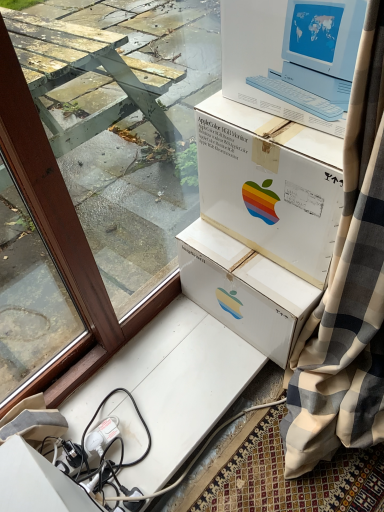
This screenshot has height=512, width=384. Find the location of `brown wood window frame at upper left`. brown wood window frame at upper left is located at coordinates (x=67, y=189).

Identify the location of white cardboard box at upper center. (270, 185).

From a real-world perspective, between white cardboard box at upper center and brown wood window frame at upper left, who is vertically higher?

In real-world perspective, brown wood window frame at upper left is above.

From the image's perspective, relative to brown wood window frame at upper left, is white cardboard box at upper center above or below?

white cardboard box at upper center is situated higher than brown wood window frame at upper left in the image.

Could you tell me if white cardboard box at upper center is facing brown wood window frame at upper left?

Yes, white cardboard box at upper center is oriented towards brown wood window frame at upper left.

Does brown wood window frame at upper left lie behind white plastic apple monitor at upper center?

No, brown wood window frame at upper left is closer to the camera.

In terms of width, does brown wood window frame at upper left look wider or thinner when compared to white plastic apple monitor at upper center?

In the image, brown wood window frame at upper left appears to be more narrow than white plastic apple monitor at upper center.

Between point (153, 100) and point (297, 16), which one is positioned in front?

The point (297, 16) is closer.

Is brown wood window frame at upper left surrounding white plastic apple monitor at upper center?

No.

Is white plastic apple monitor at upper center shorter than white cardboard box at upper center?

Yes, white plastic apple monitor at upper center is shorter than white cardboard box at upper center.

Locate an element on the screen. Image resolution: width=384 pixels, height=512 pixels. laptop in front of the white cardboard box at upper center is located at coordinates (317, 56).

From the image's perspective, is white plastic apple monitor at upper center below white cardboard box at upper center?

No, from the image's perspective, white plastic apple monitor at upper center is not beneath white cardboard box at upper center.

Who is smaller, white plastic apple monitor at upper center or white cardboard box at upper center?

With smaller size is white plastic apple monitor at upper center.

Considering the relative positions of white cardboard box at upper center and white plastic apple monitor at upper center in the image provided, is white cardboard box at upper center in front of white plastic apple monitor at upper center?

No, it is not.

Is white cardboard box at upper center beside white plastic apple monitor at upper center?

white cardboard box at upper center and white plastic apple monitor at upper center are not in contact.

Which is closer, (320,255) or (304,16)?

Clearly, point (320,255) is more distant from the camera than point (304,16).

Could you tell me if white cardboard box at upper center is turned towards white plastic apple monitor at upper center?

No, white cardboard box at upper center does not turn towards white plastic apple monitor at upper center.

How distant is brown wood window frame at upper left from white cardboard box at upper center?

19.64 inches.

Is brown wood window frame at upper left turned away from white cardboard box at upper center?

No, brown wood window frame at upper left is not facing away from white cardboard box at upper center.

Where is `window frame below the white cardboard box at upper center (from the image's perspective)`? The width and height of the screenshot is (384, 512). window frame below the white cardboard box at upper center (from the image's perspective) is located at coordinates (67, 189).

Looking at the image, does brown wood window frame at upper left seem bigger or smaller compared to white cardboard box at upper center?

In the image, brown wood window frame at upper left appears to be larger than white cardboard box at upper center.

Based on the photo, does white plastic apple monitor at upper center have a lesser height compared to brown wood window frame at upper left?

Yes, white plastic apple monitor at upper center is shorter than brown wood window frame at upper left.

Choose the correct answer: Is white plastic apple monitor at upper center inside brown wood window frame at upper left or outside it?

white plastic apple monitor at upper center lies outside brown wood window frame at upper left.

Is white plastic apple monitor at upper center next to brown wood window frame at upper left?

white plastic apple monitor at upper center and brown wood window frame at upper left are clearly separated.

Identify the location of window frame on the left of white cardboard box at upper center. (67, 189).

Image resolution: width=384 pixels, height=512 pixels. I want to click on laptop above the brown wood window frame at upper left (from a real-world perspective), so click(x=317, y=56).

Considering their positions, is white cardboard box at upper center positioned closer to brown wood window frame at upper left than white plastic apple monitor at upper center?

The object closer to brown wood window frame at upper left is white cardboard box at upper center.

Considering their positions, is brown wood window frame at upper left positioned closer to white cardboard box at upper center than white plastic apple monitor at upper center?

white plastic apple monitor at upper center.

Consider the image. Looking at the image, which one is located closer to brown wood window frame at upper left, white plastic apple monitor at upper center or white cardboard box at upper center?

white cardboard box at upper center.

When comparing their distances from white plastic apple monitor at upper center, does white cardboard box at upper center or brown wood window frame at upper left seem closer?

Based on the image, white cardboard box at upper center appears to be nearer to white plastic apple monitor at upper center.

Which object lies further to the anchor point white cardboard box at upper center, white plastic apple monitor at upper center or brown wood window frame at upper left?

brown wood window frame at upper left is positioned further to the anchor white cardboard box at upper center.

When comparing their distances from white plastic apple monitor at upper center, does brown wood window frame at upper left or white cardboard box at upper center seem further?

brown wood window frame at upper left.

This screenshot has height=512, width=384. What are the coordinates of `laptop between brown wood window frame at upper left and white cardboard box at upper center in the horizontal direction` in the screenshot? It's located at (317, 56).